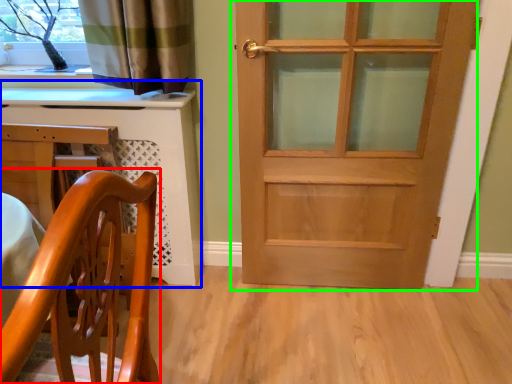
Question: Estimate the real-world distances between objects in this image. Which object is farther from chair (highlighted by a red box), computer desk (highlighted by a blue box) or door (highlighted by a green box)?

Choices:
 (A) computer desk
 (B) door

Answer: (B)